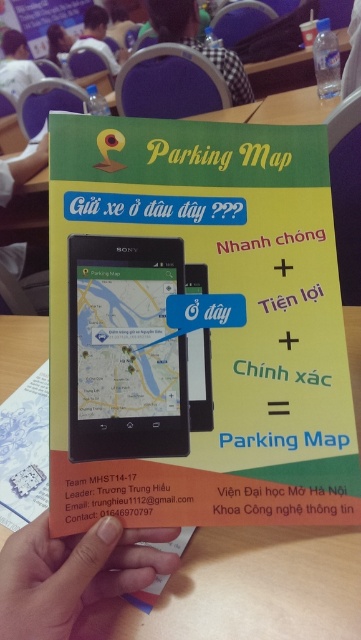
Is matte black phone at center positioned behind skinny orange card at lower center?

Yes, matte black phone at center is behind skinny orange card at lower center.

Is matte black phone at center shorter than skinny orange card at lower center?

No, matte black phone at center is not shorter than skinny orange card at lower center.

Does point (168, 412) come farther from viewer compared to point (58, 561)?

Yes, it is behind point (58, 561).

You are a GUI agent. You are given a task and a screenshot of the screen. Output one action in this format:
    pyautogui.click(x=<x>, y=<y>)
    Task: Click on the matte black phone at center
    
    Given the screenshot: What is the action you would take?
    pyautogui.click(x=124, y=349)

Which is more to the right, matte paper bulletin board at center or matte plastic hand at lower left?

Positioned to the right is matte paper bulletin board at center.

Is point (193, 508) behind point (46, 161)?

No, it is in front of (46, 161).

Where is `matte paper bulletin board at center`? The width and height of the screenshot is (361, 640). matte paper bulletin board at center is located at coordinates (196, 326).

Who is positioned more to the right, matte paper bulletin board at center or matte black phone at center?

matte paper bulletin board at center is more to the right.

Who is higher up, matte paper bulletin board at center or matte black phone at center?

matte paper bulletin board at center

Where is `matte paper bulletin board at center`? The width and height of the screenshot is (361, 640). matte paper bulletin board at center is located at coordinates (196, 326).